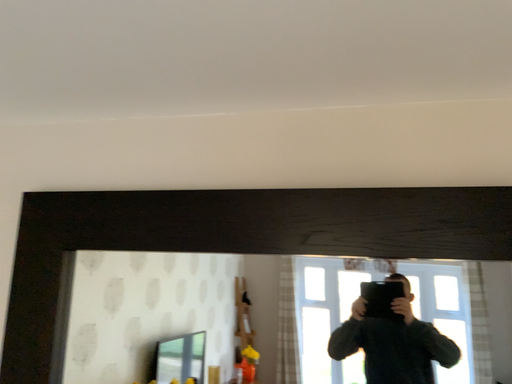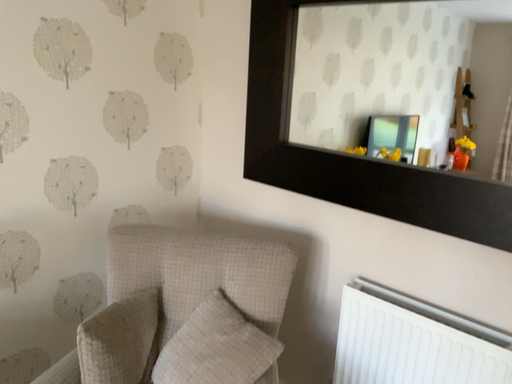
Question: Which way did the camera rotate in the video?

Choices:
 (A) rotated downward
 (B) rotated upward

Answer: (A)